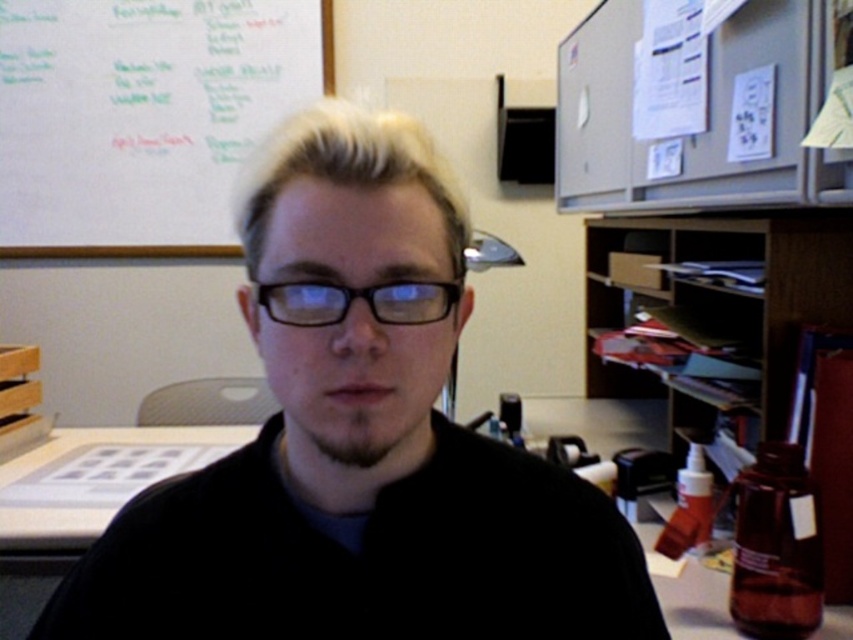
This screenshot has width=853, height=640. What do you see at coordinates (695, 604) in the screenshot? I see `matte black desk at center` at bounding box center [695, 604].

From the picture: Is matte black desk at center thinner than black plastic glasses at center?

Incorrect, matte black desk at center's width is not less than black plastic glasses at center's.

Does point (717, 620) lie in front of point (325, 301)?

No, it is behind (325, 301).

Image resolution: width=853 pixels, height=640 pixels. I want to click on matte black desk at center, so click(x=695, y=604).

What do you see at coordinates (143, 116) in the screenshot? I see `whiteboard at upper left` at bounding box center [143, 116].

Based on the photo, which of these two, whiteboard at upper left or matte black desk at center, stands taller?

whiteboard at upper left is taller.

Describe the element at coordinates (143, 116) in the screenshot. I see `whiteboard at upper left` at that location.

The image size is (853, 640). I want to click on whiteboard at upper left, so click(143, 116).

Can you confirm if whiteboard at upper left is positioned to the left of black plastic glasses at center?

Yes, whiteboard at upper left is to the left of black plastic glasses at center.

Who is taller, whiteboard at upper left or black plastic glasses at center?

Standing taller between the two is whiteboard at upper left.

Does point (140, 252) come behind point (288, 292)?

Yes, it is behind point (288, 292).

What are the coordinates of `whiteboard at upper left` in the screenshot? It's located at (143, 116).